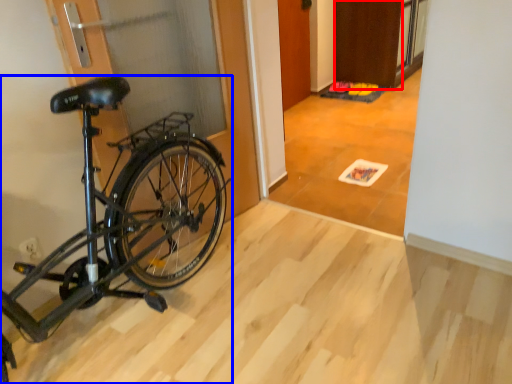
Question: Which of the following is the closest to the observer, door (highlighted by a red box) or bicycle (highlighted by a blue box)?

Choices:
 (A) door
 (B) bicycle

Answer: (B)